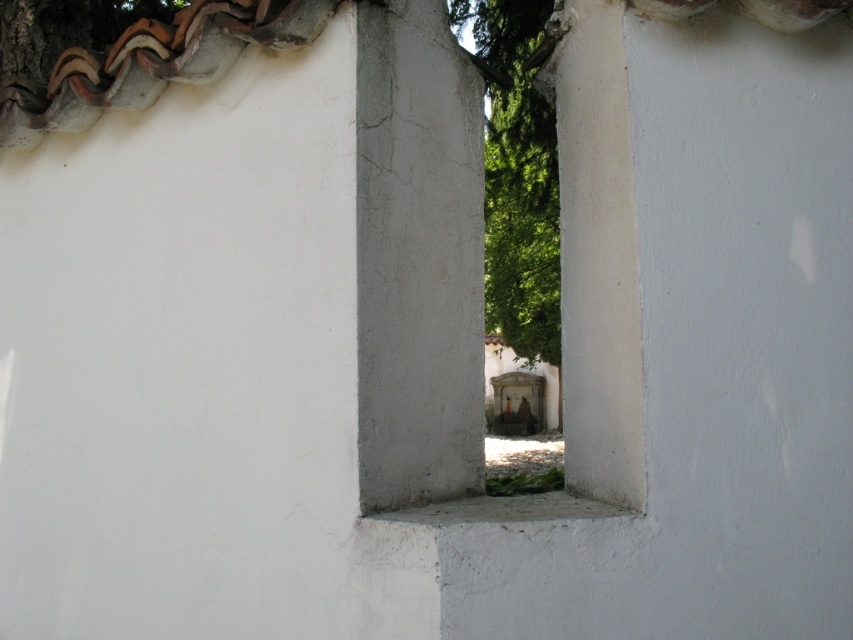
Is point (434, 205) less distant than point (553, 509)?

No, it is not.

Who is more distant from viewer, (448,376) or (495,513)?

The point (448,376) is more distant.

What are the coordinates of `white concrete pillar at center` in the screenshot? It's located at coord(416,257).

Is point (457, 8) more distant than point (558, 509)?

Yes, point (457, 8) is farther from viewer.

Is green leafy tree at center shorter than white rough concrete at center?

No, green leafy tree at center is not shorter than white rough concrete at center.

Who is more forward, (537, 332) or (515, 500)?

Point (515, 500) is in front.

Find the location of a particular element. This screenshot has height=640, width=853. green leafy tree at center is located at coordinates (517, 179).

Consider the image. Can you confirm if white rough concrete window at center is bigger than green leafy tree at center?

Actually, white rough concrete window at center might be smaller than green leafy tree at center.

Is point (376, 480) farther from camera compared to point (553, 292)?

That is False.

Where is `white rough concrete window at center`? The image size is (853, 640). white rough concrete window at center is located at coordinates (416, 262).